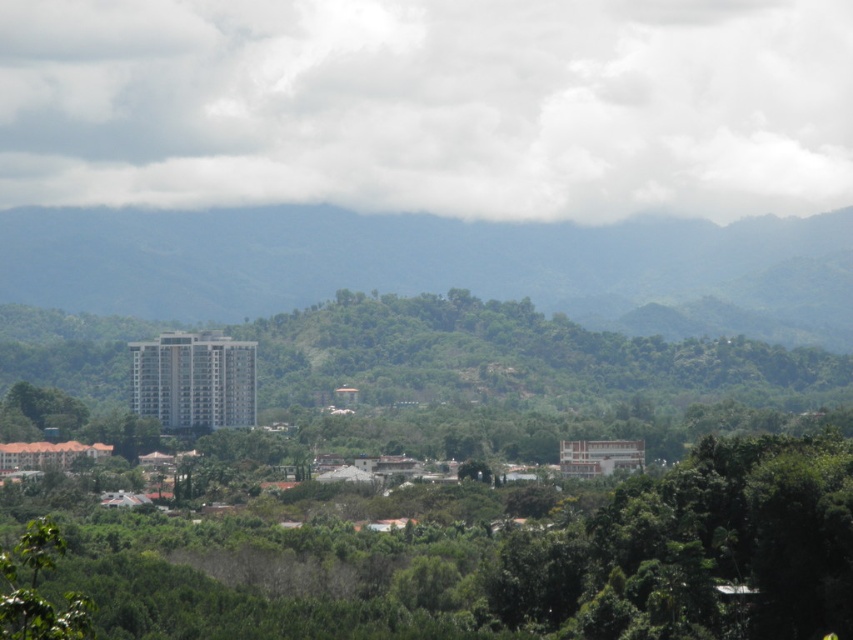
Question: Which of the following is the closest to the observer?

Choices:
 (A) white fluffy cloud at upper center
 (B) green leafy tree at center

Answer: (B)

Question: Does white fluffy cloud at upper center have a lesser width compared to green leafy tree at center?

Choices:
 (A) yes
 (B) no

Answer: (B)

Question: Is white fluffy cloud at upper center positioned behind green leafy tree at center?

Choices:
 (A) yes
 (B) no

Answer: (A)

Question: Which of the following is the farthest from the observer?

Choices:
 (A) (171, 168)
 (B) (285, 572)

Answer: (A)

Question: Which of the following is the farthest from the observer?

Choices:
 (A) (47, 172)
 (B) (166, 525)

Answer: (A)

Question: Can you confirm if white fluffy cloud at upper center is positioned above green leafy tree at center?

Choices:
 (A) no
 (B) yes

Answer: (B)